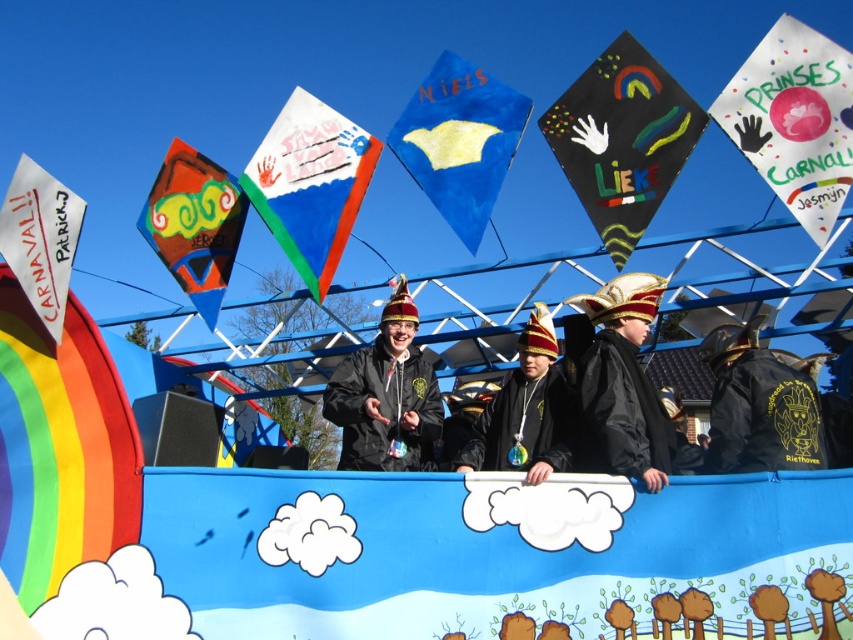
From the picture: You are a participant in the parade and want to wave the white paper flag at upper right. However, you are currently standing in front of the black leather jacket at center. Can you reach the flag without moving past the jacket?

The black leather jacket at center is behind the white paper flag at upper right, so you can reach the white paper flag at upper right without moving past the black leather jacket at center because the flag is in front of the jacket.

You are a photographer standing at the camera position. You want to take a photo of the white paper flag at upper right. The camera has a maximum focus range of 25 meters. Will the flag be in focus?

The white paper flag at upper right is 26.59 meters from the camera, which exceeds the maximum focus range of 25 meters. Therefore, the flag will not be in focus.